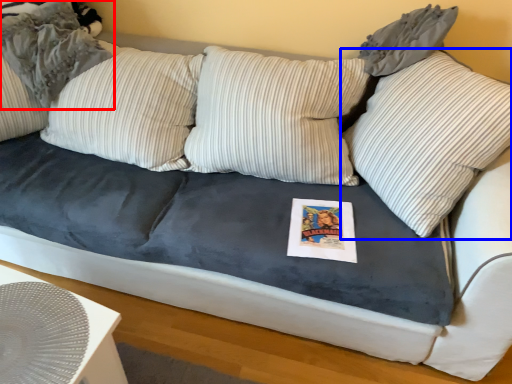
Question: Which object is further to the camera taking this photo, pillow (highlighted by a red box) or pillow (highlighted by a blue box)?

Choices:
 (A) pillow
 (B) pillow

Answer: (A)